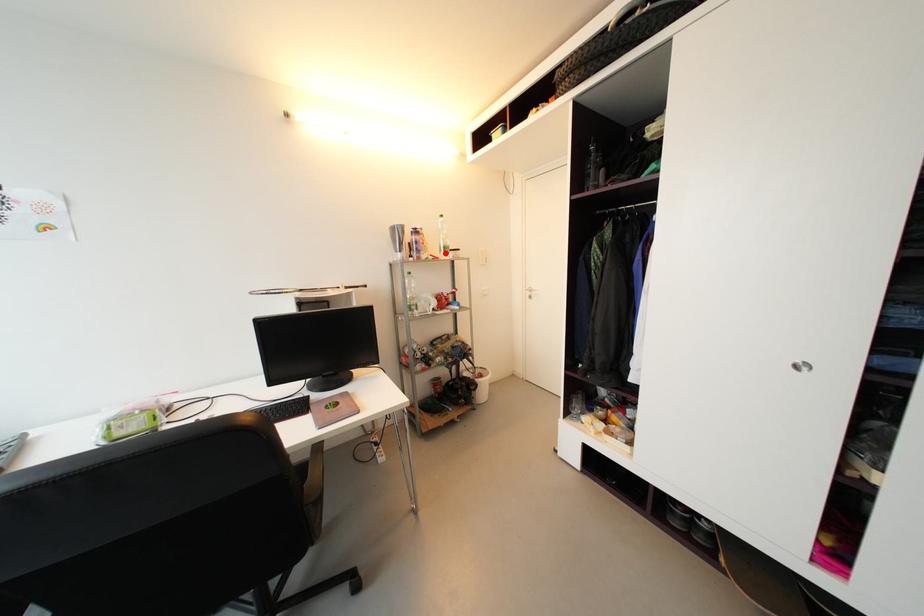
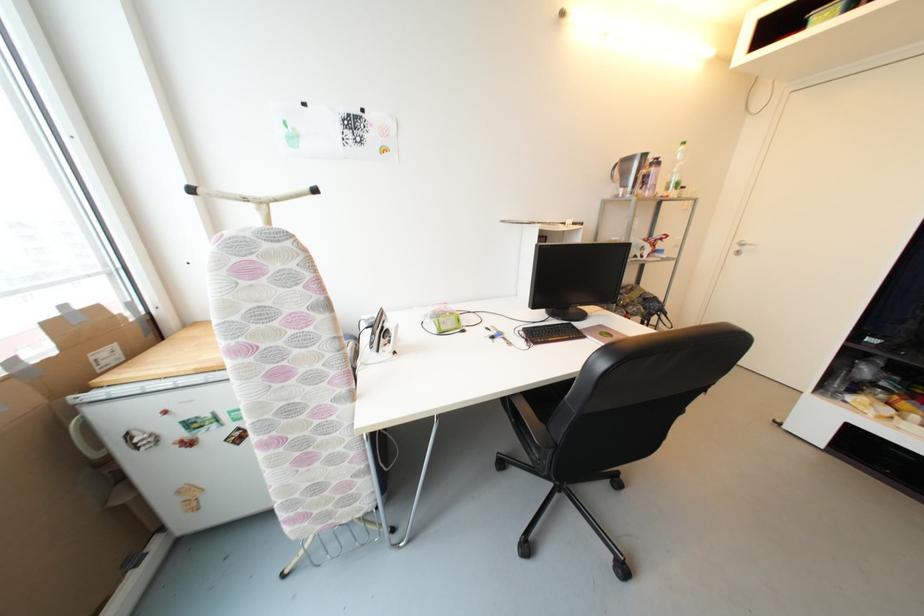
In the second image, find the point that corresponds to the highlighted location in the first image.

(673, 190)